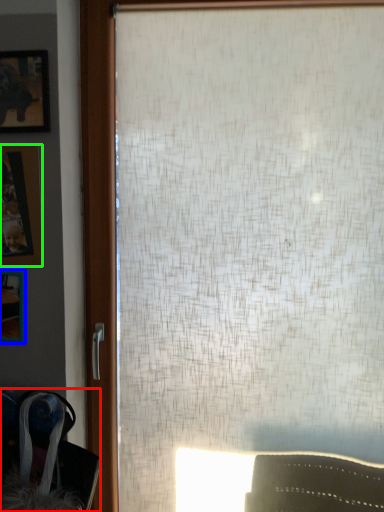
Question: Which object is positioned closest to swivel chair (highlighted by a red box)? Select from picture frame (highlighted by a blue box) and picture frame (highlighted by a green box).

Choices:
 (A) picture frame
 (B) picture frame

Answer: (A)